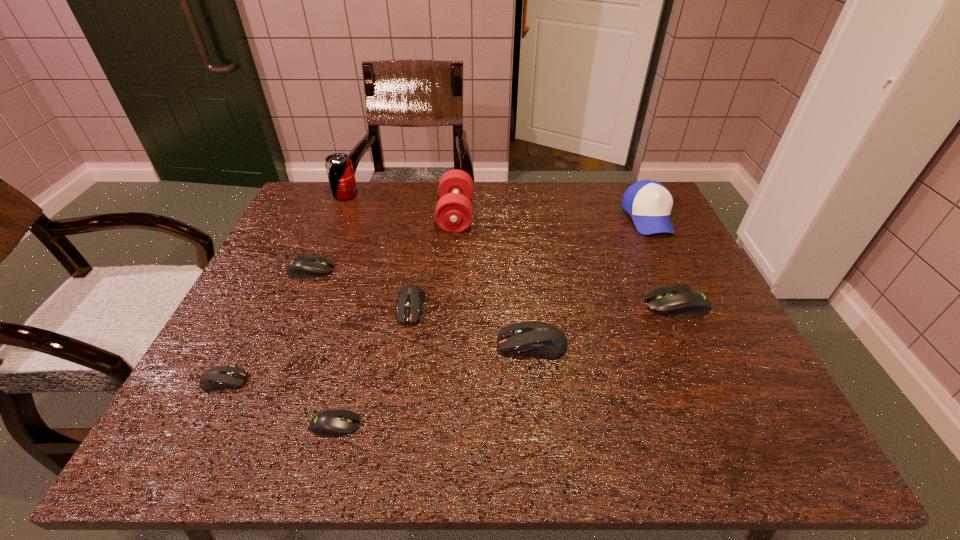
The width and height of the screenshot is (960, 540). In order to click on vacant space located on the button of the biggest dark computer equipment in this screenshot , I will do pos(413,345).

This screenshot has height=540, width=960. In order to click on free location located 0.100m on the wheel side of the rightmost gray computer mouse in this screenshot , I will do `click(602, 305)`.

This screenshot has width=960, height=540. In order to click on vacant space situated 0.370m on the wheel side of the rightmost gray computer mouse in this screenshot , I will do `click(486, 305)`.

The image size is (960, 540). Identify the location of vacant position located 0.270m on the wheel side of the rightmost gray computer mouse. (529, 305).

This screenshot has width=960, height=540. Identify the location of vacant space located 0.200m on the button of the farthest dark computer equipment. (395, 405).

Where is `vacant space situated on the wheel side of the farthest gray computer mouse`? The height and width of the screenshot is (540, 960). vacant space situated on the wheel side of the farthest gray computer mouse is located at coordinates (437, 270).

Identify the location of vacant space situated 0.240m on the button of the smallest dark computer equipment. This screenshot has width=960, height=540. (368, 381).

The width and height of the screenshot is (960, 540). Identify the location of free region located on the wheel side of the nearest object. (547, 425).

Identify the location of soda can present at the far edge. (339, 168).

The image size is (960, 540). In order to click on dumbbell situated at the far edge in this screenshot , I will do `click(454, 212)`.